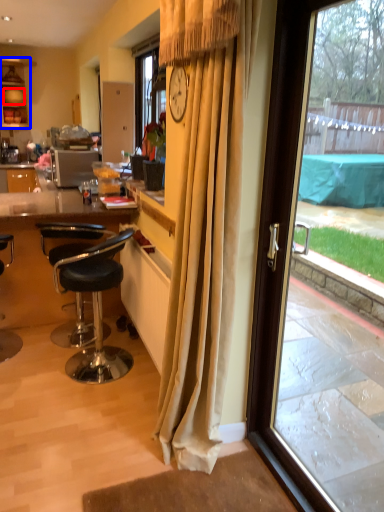
Question: Which point is further to the camera, plate (highlighted by a red box) or cabinetry (highlighted by a blue box)?

Choices:
 (A) plate
 (B) cabinetry

Answer: (A)